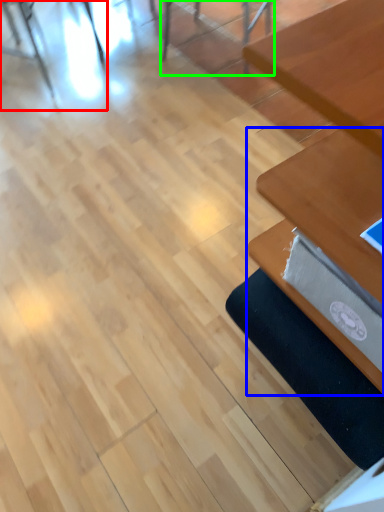
Question: Estimate the real-world distances between objects in this image. Which object is farther from chair (highlighted by a red box), table (highlighted by a blue box) or chair (highlighted by a green box)?

Choices:
 (A) table
 (B) chair

Answer: (A)